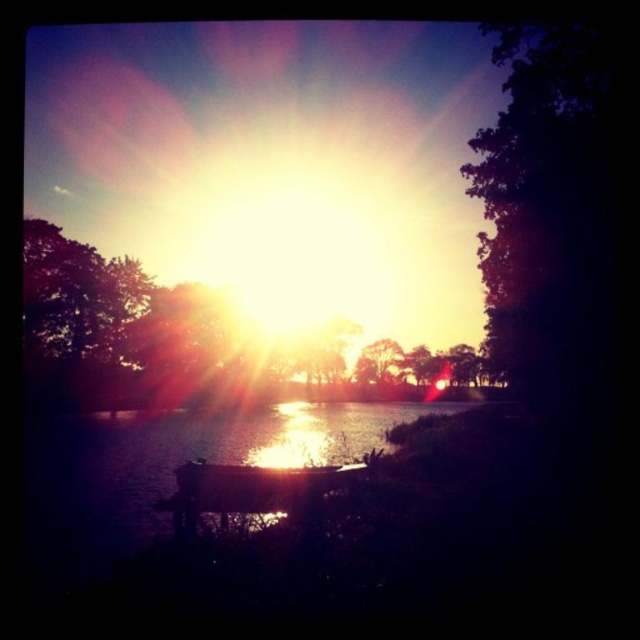
You are standing on the shore of the lake and see the dark purple leafy tree at right and the metallic silver boat at center. Which object is closer to you?

The dark purple leafy tree at right is closer to you because it is in front of the metallic silver boat at center.